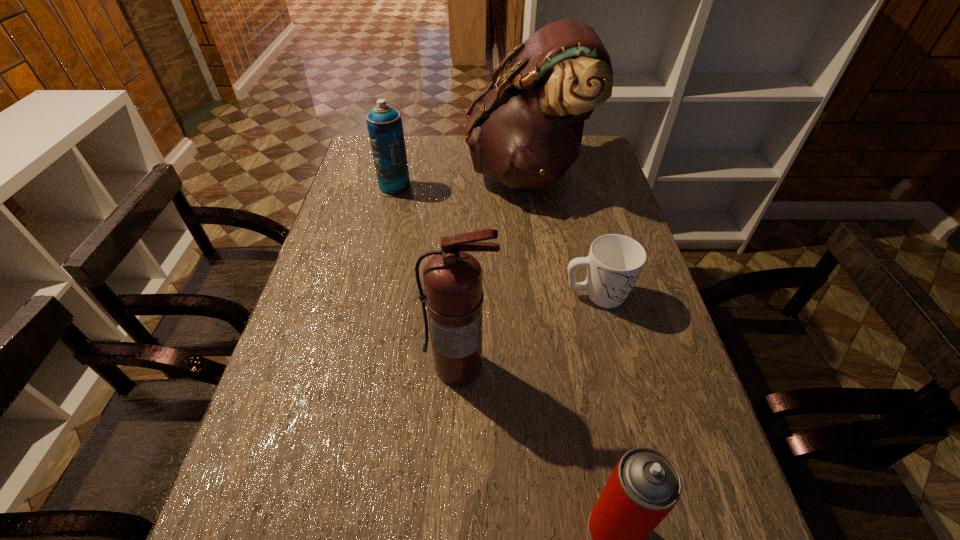
Locate an element on the screen. free spot located on the front-facing side of the second tallest object is located at coordinates (454, 531).

This screenshot has height=540, width=960. I want to click on vacant region located 0.120m on the left of the farther aerosol can, so click(x=343, y=188).

This screenshot has height=540, width=960. What are the coordinates of `vacant area situated on the side of the third nearest object with the handle` in the screenshot? It's located at (654, 295).

Identify the location of object at the far edge. The height and width of the screenshot is (540, 960). (525, 132).

Locate an element on the screen. object that is at the left edge is located at coordinates (385, 128).

Locate an element on the screen. The image size is (960, 540). satchel that is positioned at the right edge is located at coordinates (525, 132).

At what (x,y) coordinates should I click in order to perform the action: click on mug at the right edge. Please return your answer as a coordinate pair (x, y). This screenshot has height=540, width=960. Looking at the image, I should click on (614, 264).

Identify the location of object that is at the far right corner. The width and height of the screenshot is (960, 540). (525, 132).

In order to click on vacant space at the far edge of the desktop in this screenshot , I will do `click(450, 137)`.

The width and height of the screenshot is (960, 540). In the image, there is a desktop. What are the coordinates of `vacant region at the left edge` in the screenshot? It's located at (253, 507).